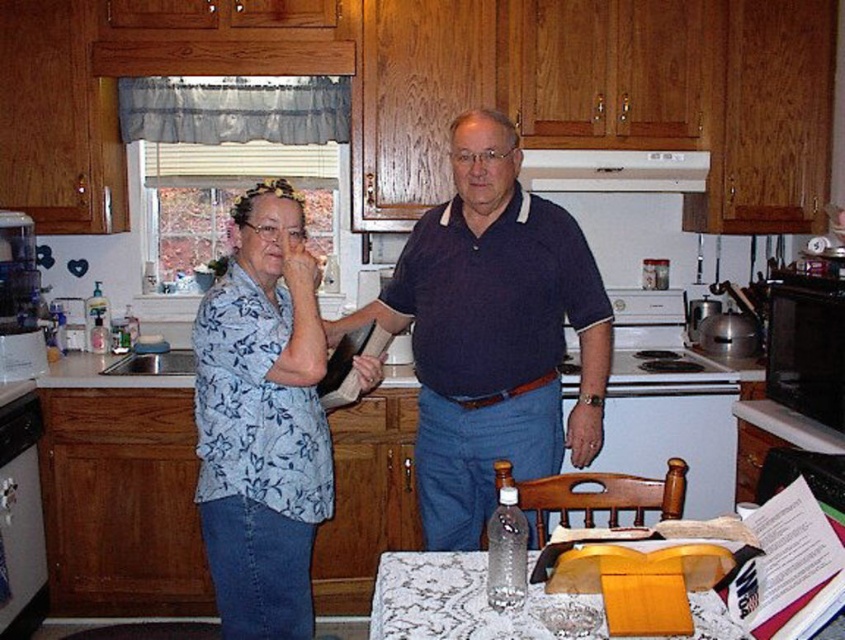
You are standing in the kitchen and see two people at the center. Which person is wearing the dark blue polo shirt at center located to the right of the blue floral shirt at center?

The dark blue polo shirt at center is located to the right of the blue floral shirt at center, so the man wearing the dark blue polo shirt at center is to the right of the woman in the blue floral shirt at center.

You are a chef trying to reach the white glossy exhaust hood at upper center to clean it. There is a dark blue polo shirt at center in the way. Can you move around it to access the exhaust hood?

The dark blue polo shirt at center is in front of the white glossy exhaust hood at upper center, so you can move around it to access the exhaust hood.